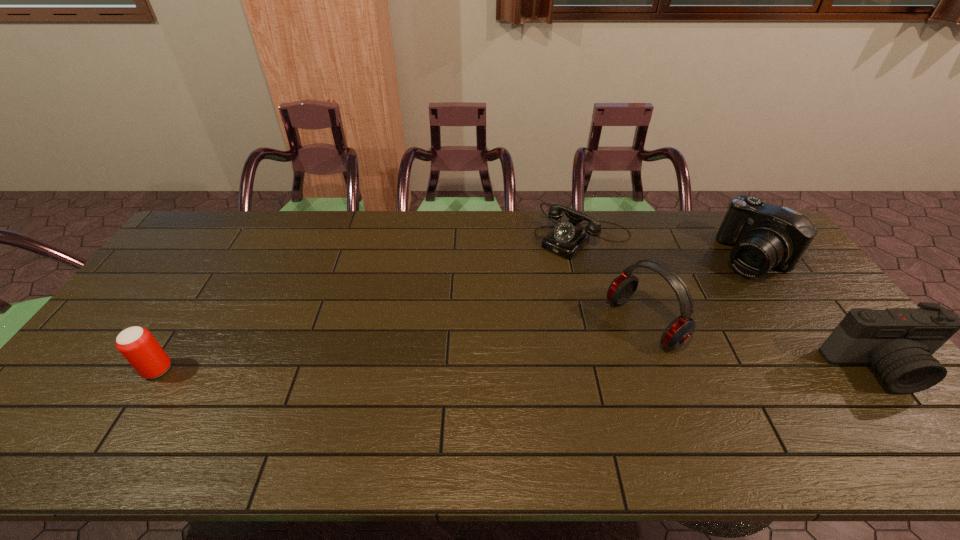
Where is `vacant point located 0.110m on the front-facing side of the shortest object`? The image size is (960, 540). vacant point located 0.110m on the front-facing side of the shortest object is located at coordinates (539, 272).

In order to click on free space located 0.150m on the front-facing side of the shortest object in this screenshot , I will do `click(531, 279)`.

You are a GUI agent. You are given a task and a screenshot of the screen. Output one action in this format:
    pyautogui.click(x=<x>, y=<y>)
    Task: Click on the blank area located 0.170m on the front-facing side of the shortest object
    
    Given the screenshot: What is the action you would take?
    pyautogui.click(x=528, y=282)

The width and height of the screenshot is (960, 540). What are the coordinates of `vacant region located on the lens of the farther camera` in the screenshot? It's located at (676, 323).

This screenshot has width=960, height=540. I want to click on vacant space located 0.250m on the lens of the farther camera, so click(x=690, y=312).

Find the location of a particular element. The width and height of the screenshot is (960, 540). free space located 0.230m on the lens of the farther camera is located at coordinates (694, 308).

At what (x,y) coordinates should I click in order to perform the action: click on telephone located in the far edge section of the desktop. Please return your answer as a coordinate pair (x, y). This screenshot has width=960, height=540. Looking at the image, I should click on (566, 239).

Find the location of a particular element. The height and width of the screenshot is (540, 960). camera present at the far edge is located at coordinates (765, 236).

The image size is (960, 540). In order to click on object situated at the near edge in this screenshot , I will do `click(898, 343)`.

At what (x,y) coordinates should I click in order to perform the action: click on object that is at the left edge. Please return your answer as a coordinate pair (x, y). This screenshot has height=540, width=960. Looking at the image, I should click on (138, 346).